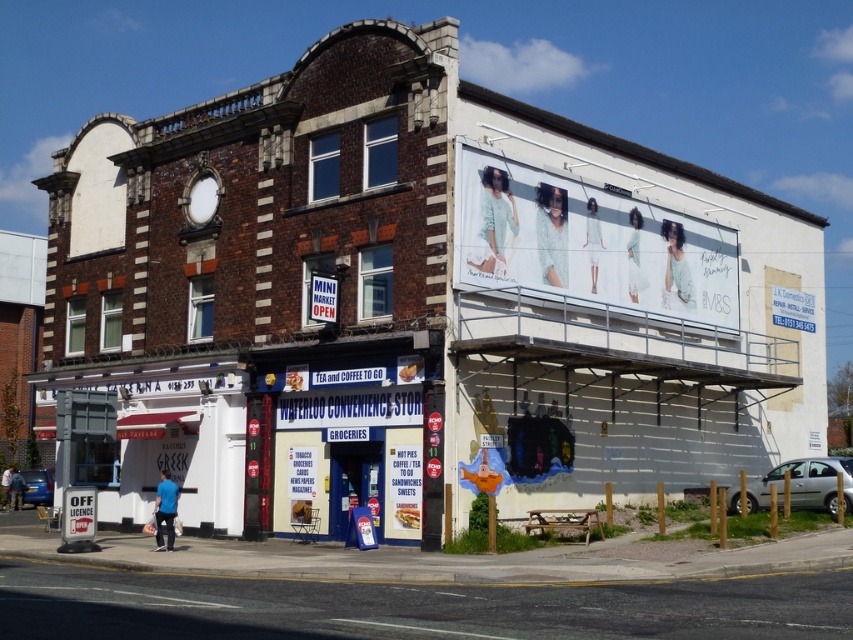
Question: Which point is farther to the camera?

Choices:
 (A) metallic blue sedan at lower left
 (B) silver metallic van at lower right

Answer: (A)

Question: Where is silver metallic van at lower right located in relation to metallic blue sedan at lower left in the image?

Choices:
 (A) below
 (B) above

Answer: (B)

Question: Does silver metallic van at lower right have a smaller size compared to metallic blue sedan at lower left?

Choices:
 (A) yes
 (B) no

Answer: (A)

Question: Which point is farther to the camera?

Choices:
 (A) metallic blue sedan at lower left
 (B) silver metallic van at lower right

Answer: (A)

Question: Where is silver metallic van at lower right located in relation to metallic blue sedan at lower left in the image?

Choices:
 (A) left
 (B) right

Answer: (B)